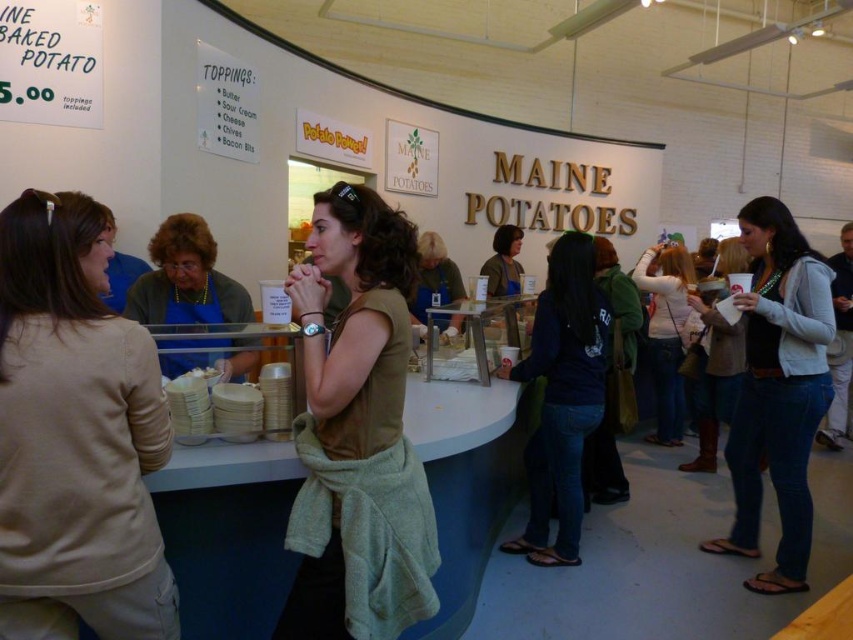
You are a customer at the food stand and want to order the item displayed on the counter. You see the dark blue jeans at center and the matte green sweater at center. Which item is positioned to the right of the other?

The dark blue jeans at center is to the right of the matte green sweater at center.

You are a customer at the food stand and notice the woman wearing both the green matte shirt at center and the blue apron at center. Which clothing item is narrower when viewed from the front?

The green matte shirt at center is thinner than the blue apron at center, so the green matte shirt at center is narrower when viewed from the front.

You are a customer at the food stand and want to identify the clothing items worn by the server. Which item is smaller in size between the green matte shirt at center and the blue apron at center?

The green matte shirt at center is smaller than the blue apron at center according to the description.